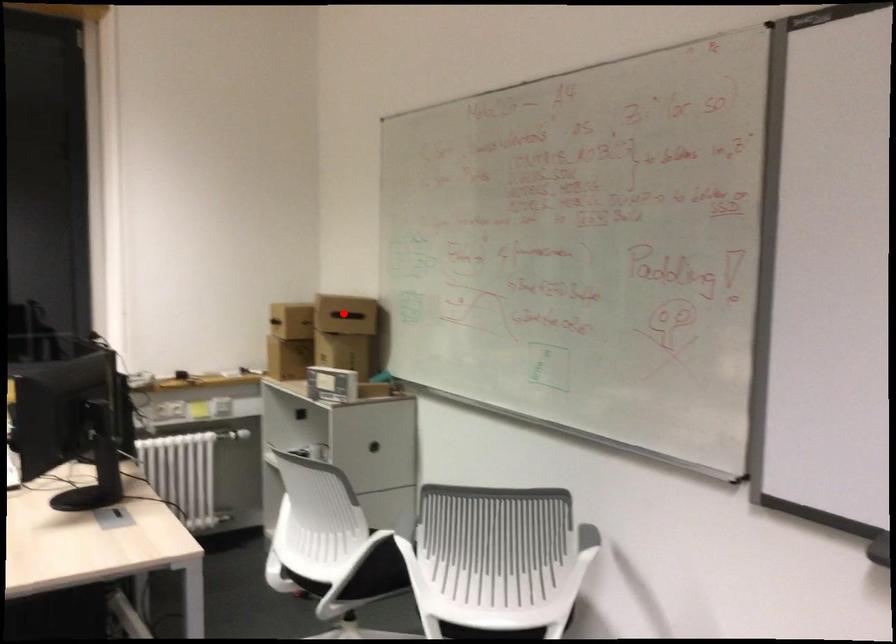
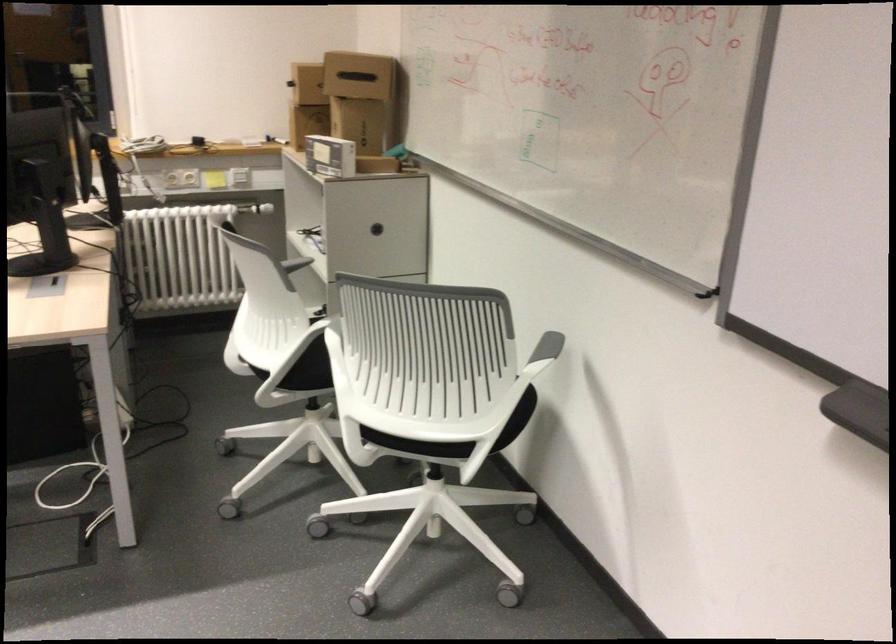
Question: I am providing you with two images of the same scene from different viewpoints. A red point is shown in image1. For the corresponding object point in image2, is it positioned nearer or farther from the camera?

Choices:
 (A) Nearer
 (B) Farther

Answer: (A)